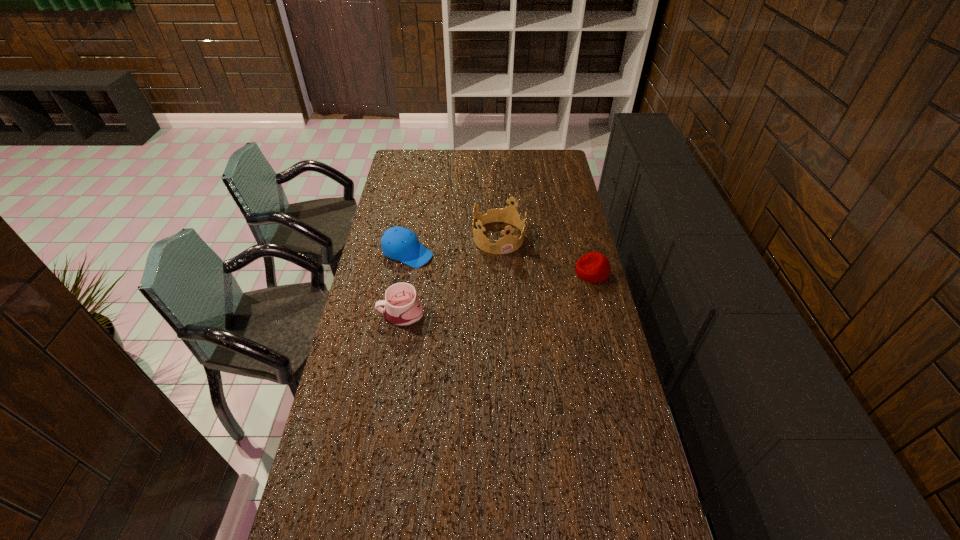
Where is `free space on the desktop that is between the nearest object and the beanbag and is positioned on the front-facing side of the tallest object`? free space on the desktop that is between the nearest object and the beanbag and is positioned on the front-facing side of the tallest object is located at coordinates (525, 287).

Where is `vacant space on the desktop that is between the nearest object and the beanbag and is positioned on the front-facing side of the cap`? The width and height of the screenshot is (960, 540). vacant space on the desktop that is between the nearest object and the beanbag and is positioned on the front-facing side of the cap is located at coordinates (500, 292).